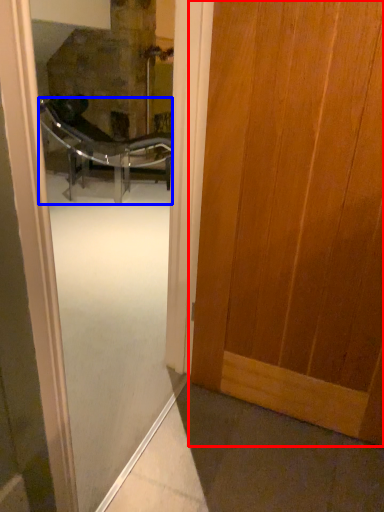
Question: Which point is further to the camera, door (highlighted by a red box) or chair (highlighted by a blue box)?

Choices:
 (A) door
 (B) chair

Answer: (B)